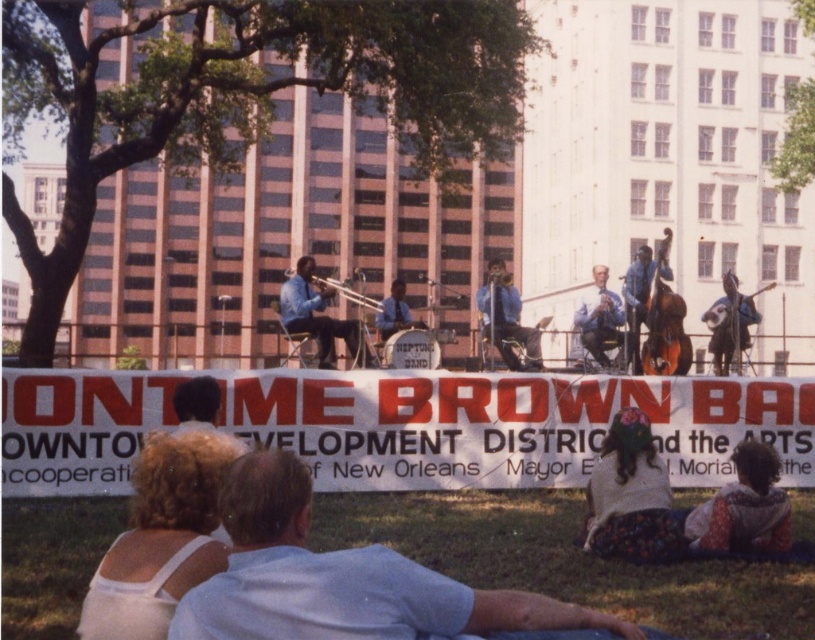
Who is lower down, white cotton shirt at lower center or shiny silver guitar at right?

white cotton shirt at lower center is lower down.

Is point (236, 580) more distant than point (739, 326)?

No, it is not.

At what (x,y) coordinates should I click in order to perform the action: click on white cotton shirt at lower center. Please return your answer as a coordinate pair (x, y). This screenshot has width=815, height=640. Looking at the image, I should click on (341, 579).

Between point (196, 620) and point (670, 234), which one is positioned in front?

Point (196, 620) is more forward.

Is white cotton shirt at lower center to the right of shiny black bass at center from the viewer's perspective?

No, white cotton shirt at lower center is not to the right of shiny black bass at center.

Who is more distant from viewer, [254,534] or [633,352]?

Result: Positioned behind is point [633,352].

Locate an element on the screen. The image size is (815, 640). white cotton shirt at lower center is located at coordinates (341, 579).

Is white fabric at lower left positioned in front of floral fabric dress at lower right?

That is True.

Can you confirm if white fabric at lower left is positioned to the left of floral fabric dress at lower right?

Correct, you'll find white fabric at lower left to the left of floral fabric dress at lower right.

Identify the location of white fabric at lower left. (161, 536).